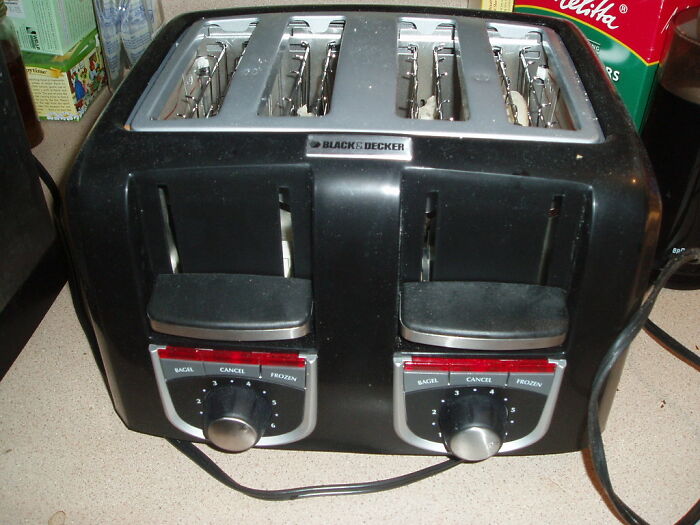
At what (x,y) coordinates should I click in order to perform the action: click on toaster. Please return your answer as a coordinate pair (x, y). This screenshot has height=525, width=700. Looking at the image, I should click on (354, 295).